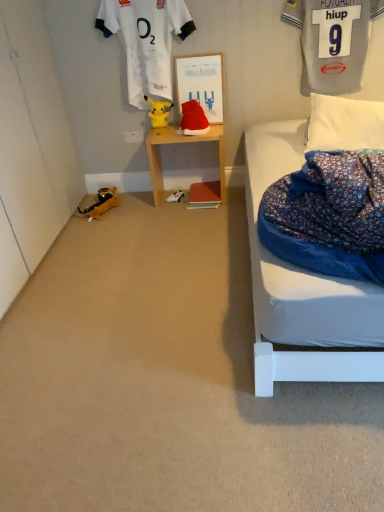
Question: Can you confirm if yellow plush toy at center, the 3th toy when ordered from bottom to top, is bigger than white plastic power outlet at lower center?

Choices:
 (A) no
 (B) yes

Answer: (B)

Question: From a real-world perspective, is yellow plush toy at center, the 1th toy in the top-to-bottom sequence, on top of white plastic power outlet at lower center?

Choices:
 (A) no
 (B) yes

Answer: (B)

Question: Is yellow plush toy at center, the 3th toy when ordered from bottom to top, next to white plastic power outlet at lower center and touching it?

Choices:
 (A) no
 (B) yes

Answer: (A)

Question: Would you say yellow plush toy at center, the 3th toy when ordered from bottom to top, contains white plastic power outlet at lower center?

Choices:
 (A) no
 (B) yes

Answer: (A)

Question: From a real-world perspective, is yellow plush toy at center, the 3th toy when ordered from bottom to top, positioned under white plastic power outlet at lower center based on gravity?

Choices:
 (A) yes
 (B) no

Answer: (B)

Question: Can you confirm if yellow plush toy at center, the 3th toy when ordered from bottom to top, is wider than white plastic power outlet at lower center?

Choices:
 (A) no
 (B) yes

Answer: (B)

Question: Does matte cardboard bulletin board at center contain wooden nightstand at center?

Choices:
 (A) yes
 (B) no

Answer: (B)

Question: Is matte cardboard bulletin board at center wider than wooden nightstand at center?

Choices:
 (A) no
 (B) yes

Answer: (A)

Question: Can you confirm if matte cardboard bulletin board at center is thinner than wooden nightstand at center?

Choices:
 (A) no
 (B) yes

Answer: (B)

Question: Does matte cardboard bulletin board at center have a larger size compared to wooden nightstand at center?

Choices:
 (A) yes
 (B) no

Answer: (B)

Question: Is matte cardboard bulletin board at center oriented away from wooden nightstand at center?

Choices:
 (A) no
 (B) yes

Answer: (A)

Question: Does matte cardboard bulletin board at center have a smaller size compared to wooden nightstand at center?

Choices:
 (A) no
 (B) yes

Answer: (B)

Question: Does yellow plush toy at center, the 2th toy viewed from the left, have a larger size compared to white soft pillow at right?

Choices:
 (A) yes
 (B) no

Answer: (B)